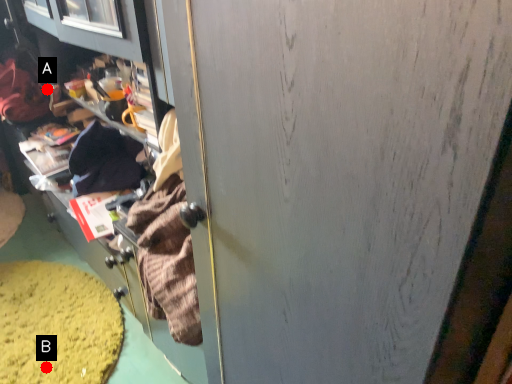
Question: Two points are circled on the image, labeled by A and B beside each circle. Which point is farther to the camera?

Choices:
 (A) A is further
 (B) B is further

Answer: (A)